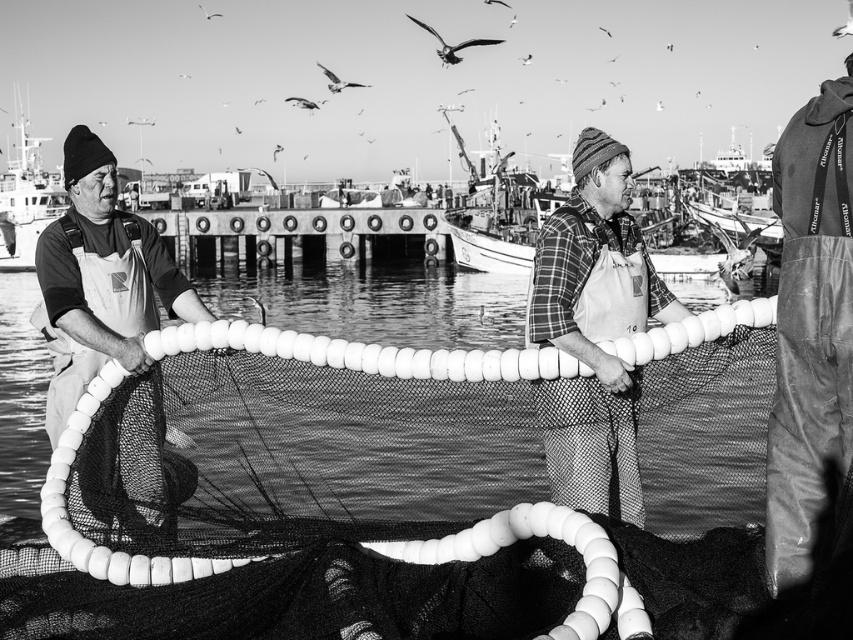
You are a photographer trying to capture a photo of the plaid fabric shirt at center and the matte white net at left. If you want to ensure both subjects are in focus, which one should you focus on first to account for their size difference?

The plaid fabric shirt at center is much taller than the matte white net at left. To ensure both are in focus, you should focus on the plaid fabric shirt at center first since it is larger and closer to the camera, allowing the depth of field to cover the smaller matte white net at left.

You are standing on the dock and want to reach the metallic boat at left without stepping into the water. Is the leather pants at lower right blocking your path?

The leather pants at lower right is in front of the metallic boat at left, so it is blocking the path to the metallic boat at left. You need to move around it to reach the boat without stepping into the water.